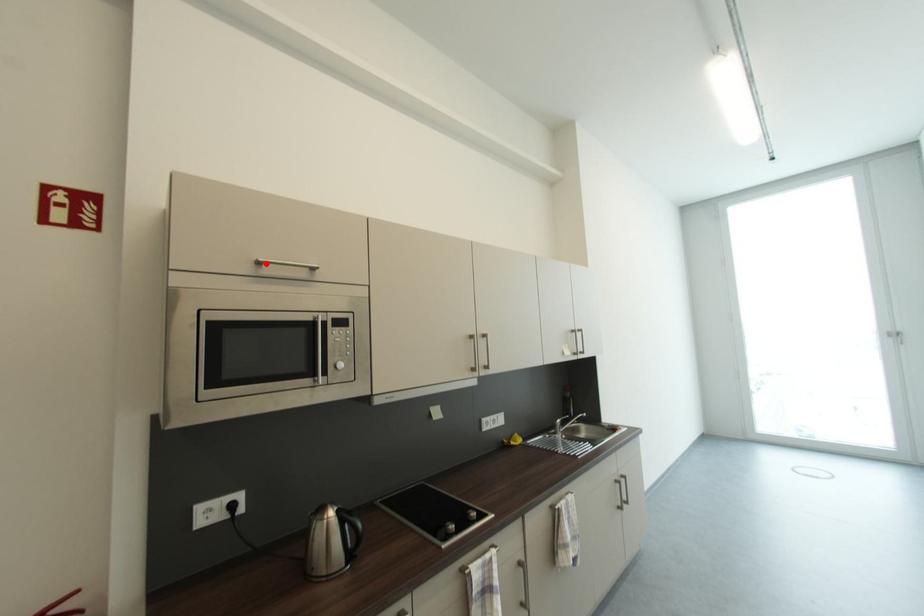
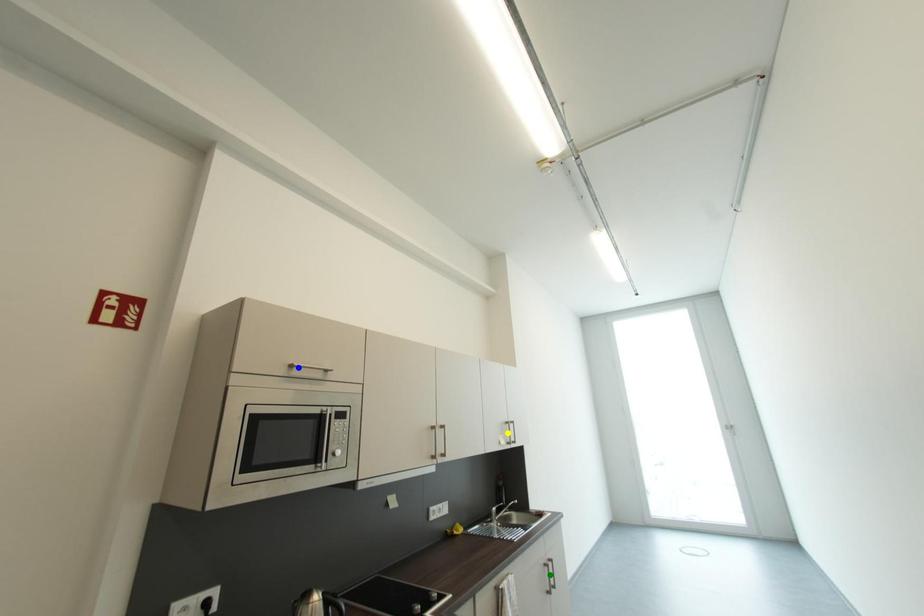
Question: I am providing you with two images of the same scene from different viewpoints. A red point is marked on the first image. You are given multiple points on the second image. Can you choose the point in image 2 that corresponds to the point in image 1?

Choices:
 (A) green point
 (B) yellow point
 (C) blue point

Answer: (C)